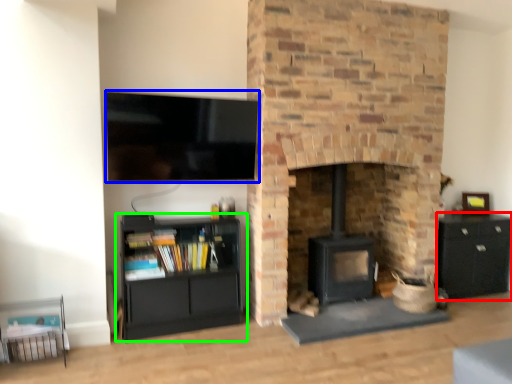
Question: Which object is positioned farthest from cabinetry (highlighted by a red box)? Select from television (highlighted by a blue box) and shelf (highlighted by a green box).

Choices:
 (A) television
 (B) shelf

Answer: (A)